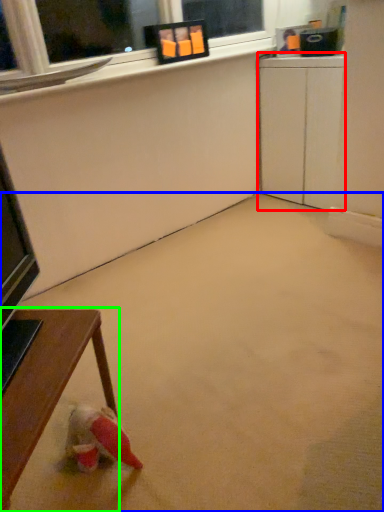
Question: Which object is positioned farthest from computer desk (highlighted by a red box)? Select from concrete (highlighted by a blue box) and table (highlighted by a green box).

Choices:
 (A) concrete
 (B) table

Answer: (B)